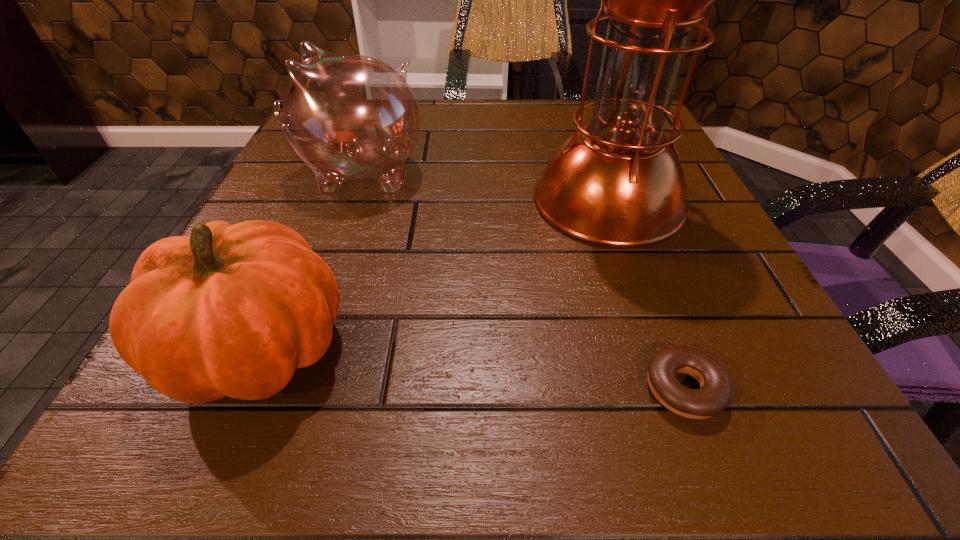
This screenshot has height=540, width=960. Find the location of `vacant space at the right edge`. vacant space at the right edge is located at coordinates (782, 334).

This screenshot has width=960, height=540. I want to click on blank space at the near right corner, so click(682, 433).

The image size is (960, 540). Identify the location of free space between the piggy bank and the doughnut. (522, 280).

Where is `free area in between the piggy bank and the tallest object`? The image size is (960, 540). free area in between the piggy bank and the tallest object is located at coordinates (484, 186).

Where is `free space between the shortest object and the piggy bank`? free space between the shortest object and the piggy bank is located at coordinates (522, 280).

At what (x,y) coordinates should I click in order to perform the action: click on free space between the piggy bank and the shortest object. Please return your answer as a coordinate pair (x, y). This screenshot has height=540, width=960. Looking at the image, I should click on (522, 280).

The height and width of the screenshot is (540, 960). What are the coordinates of `empty space that is in between the tallest object and the shortest object` in the screenshot? It's located at (646, 294).

Where is `free space between the piggy bank and the doughnut`? This screenshot has height=540, width=960. free space between the piggy bank and the doughnut is located at coordinates (522, 280).

Where is `empty location between the shortest object and the pumpkin`? empty location between the shortest object and the pumpkin is located at coordinates (471, 368).

Where is `vacant region between the doughnut and the piggy bank`? vacant region between the doughnut and the piggy bank is located at coordinates (522, 280).